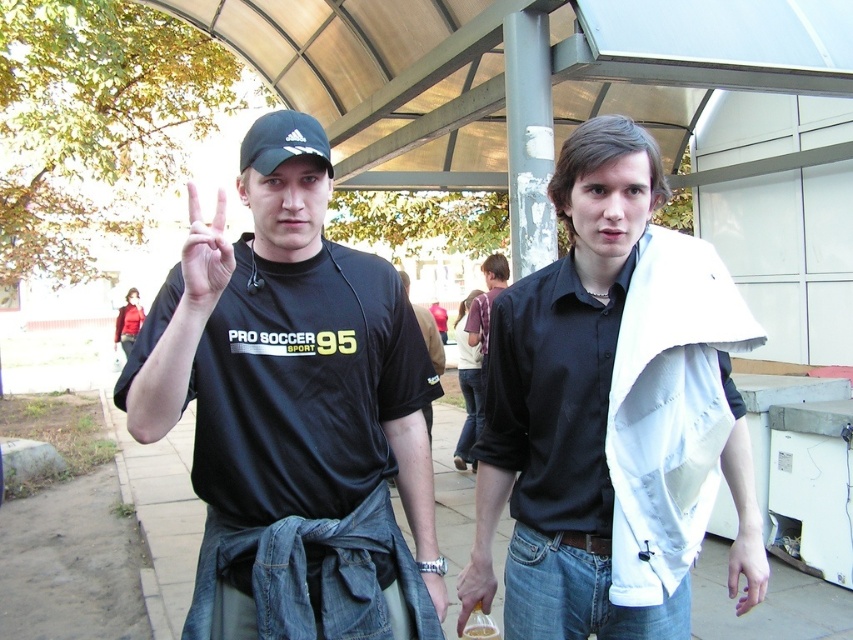
Can you confirm if white cotton shirt at center is positioned below black adidas cap at center?

Yes.

Is point (572, 342) farther from viewer compared to point (328, 156)?

Yes, point (572, 342) is farther from viewer.

Which is behind, point (605, 403) or point (285, 122)?

Positioned behind is point (605, 403).

I want to click on white cotton shirt at center, so click(564, 371).

In the scene shown: Is black adidas cap at center closer to the viewer compared to pale skin hand at lower right?

Yes, black adidas cap at center is closer to the viewer.

The width and height of the screenshot is (853, 640). What do you see at coordinates (282, 141) in the screenshot? I see `black adidas cap at center` at bounding box center [282, 141].

Where is `black adidas cap at center`? The width and height of the screenshot is (853, 640). black adidas cap at center is located at coordinates (x=282, y=141).

Is black matte t-shirt at center smaller than pale skin hand at lower right?

Actually, black matte t-shirt at center might be larger than pale skin hand at lower right.

Does black matte t-shirt at center appear under pale skin hand at lower right?

Actually, black matte t-shirt at center is above pale skin hand at lower right.

Find the location of a particular element. black matte t-shirt at center is located at coordinates (299, 385).